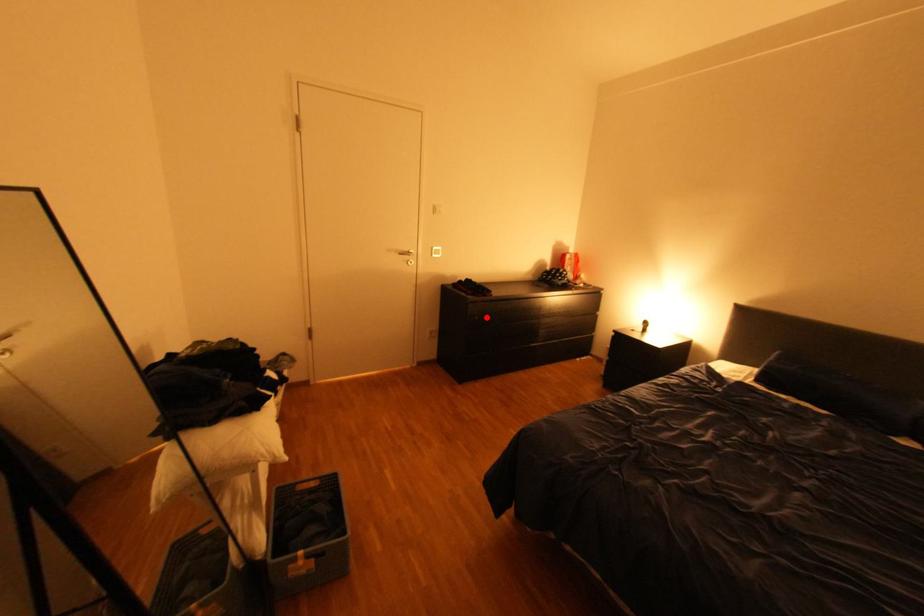
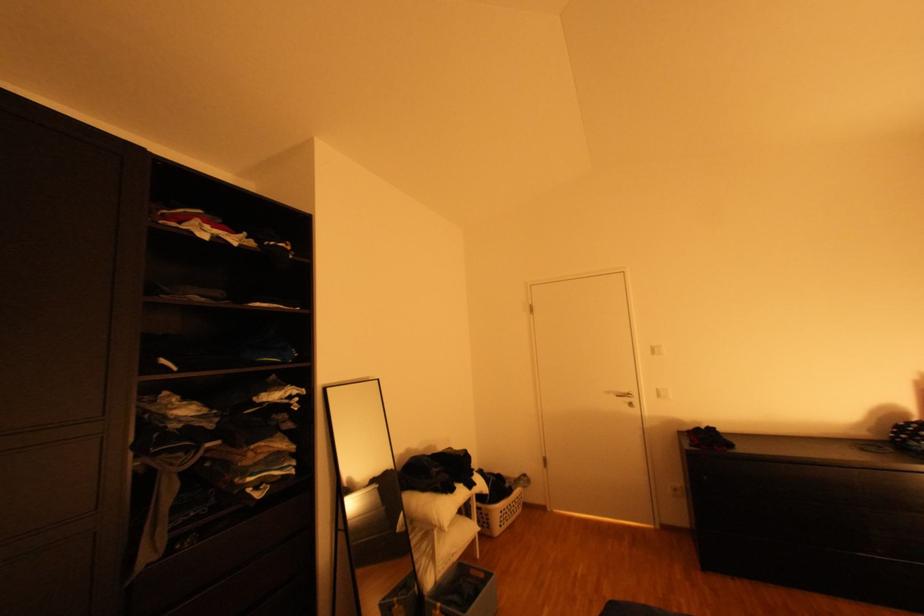
The point at the highlighted location is marked in the first image. Where is the corresponding point in the second image?

(715, 477)